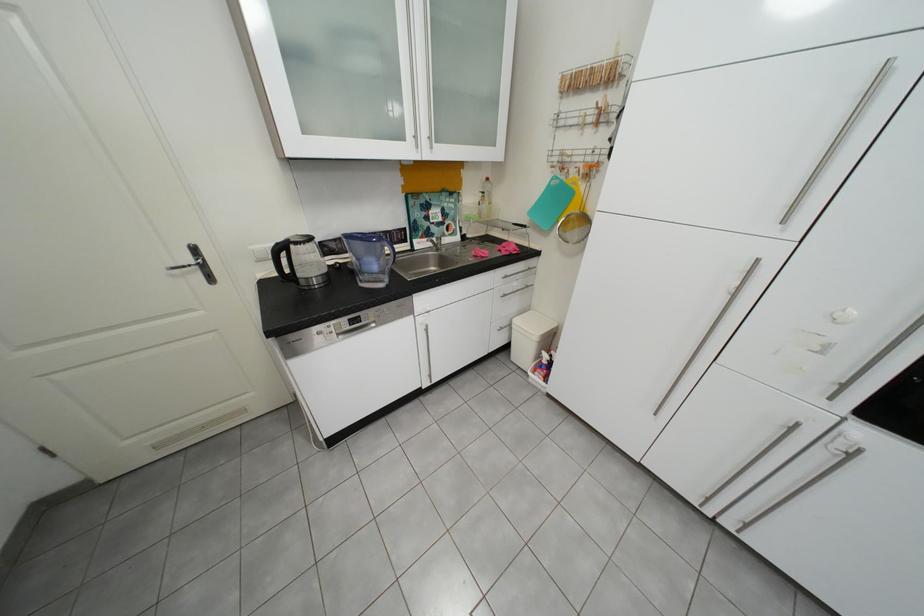
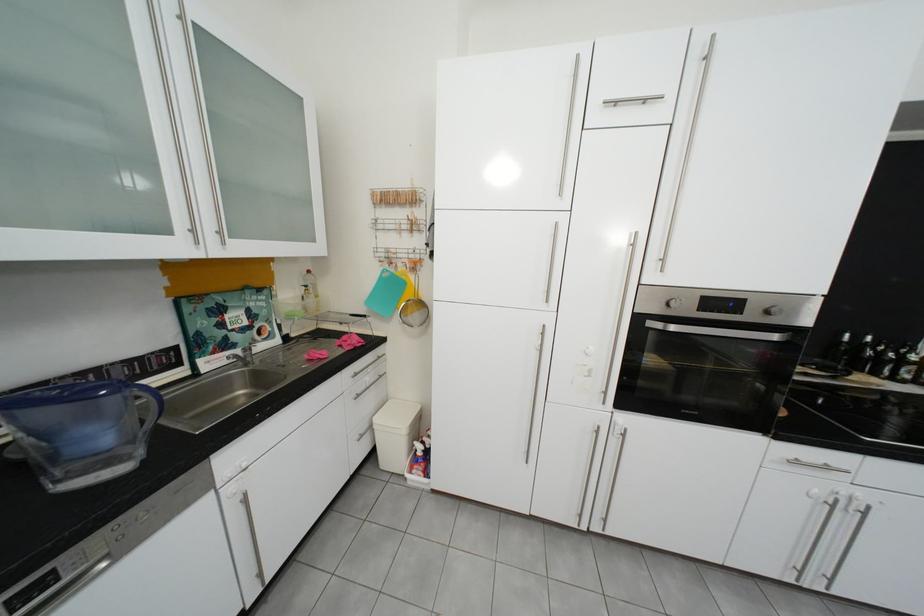
The point at (488,214) is marked in the first image. Where is the corresponding point in the second image?

(311, 310)